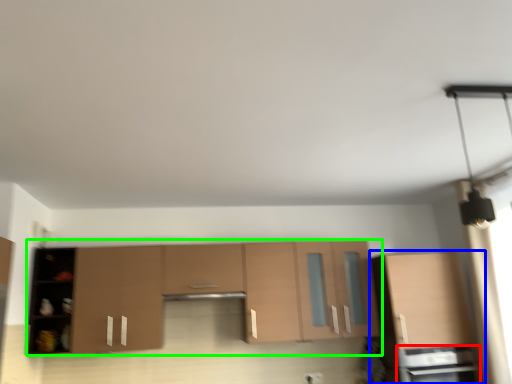
Question: Which object is positioned closest to appliance (highlighted by a red box)? Select from cabinetry (highlighted by a blue box) and cabinetry (highlighted by a green box).

Choices:
 (A) cabinetry
 (B) cabinetry

Answer: (A)